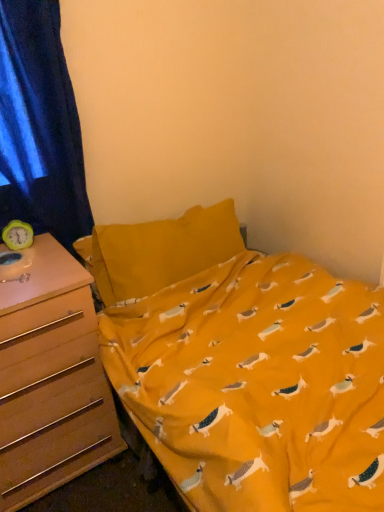
Question: From their relative heights in the image, would you say blue velvet curtain at left is taller or shorter than wooden drawer at left?

Choices:
 (A) tall
 (B) short

Answer: (A)

Question: From a real-world perspective, is blue velvet curtain at left positioned above or below wooden drawer at left?

Choices:
 (A) below
 (B) above

Answer: (B)

Question: Is point (14, 161) closer or farther from the camera than point (66, 368)?

Choices:
 (A) closer
 (B) farther

Answer: (B)

Question: Considering the positions of wooden drawer at left and blue velvet curtain at left in the image, is wooden drawer at left wider or thinner than blue velvet curtain at left?

Choices:
 (A) thin
 (B) wide

Answer: (B)

Question: Relative to blue velvet curtain at left, is wooden drawer at left in front or behind?

Choices:
 (A) behind
 (B) front

Answer: (B)

Question: From a real-world perspective, is wooden drawer at left above or below blue velvet curtain at left?

Choices:
 (A) above
 (B) below

Answer: (B)

Question: Is wooden drawer at left situated inside blue velvet curtain at left or outside?

Choices:
 (A) outside
 (B) inside

Answer: (A)